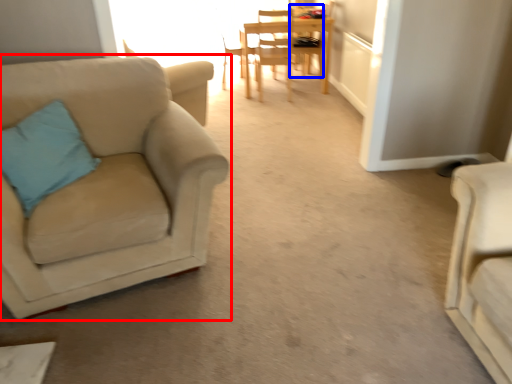
Question: Which of the following is the closest to the observer, chair (highlighted by a red box) or chair (highlighted by a blue box)?

Choices:
 (A) chair
 (B) chair

Answer: (A)